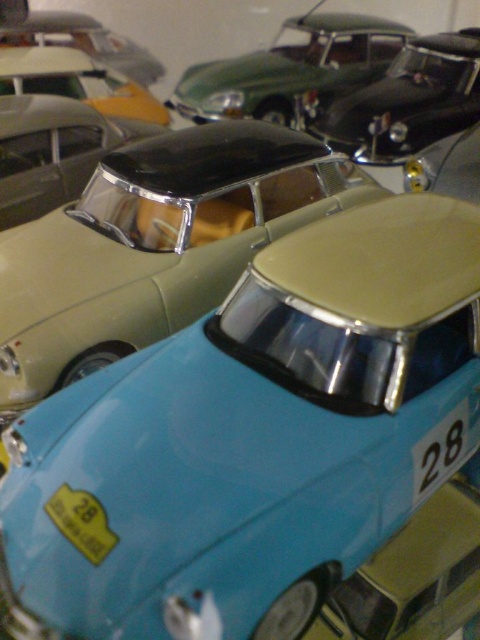
Based on the photo, who is lower down, light blue plastic car at center or metallic green car at upper center?

light blue plastic car at center

Which is behind, point (75, 221) or point (237, 90)?

Positioned behind is point (237, 90).

Who is more distant from viewer, (245, 250) or (295, 118)?

Positioned behind is point (295, 118).

Find the location of a particular element. The image size is (480, 640). light blue plastic car at center is located at coordinates (154, 244).

Which of these two, light blue glossy car at center or light blue plastic car at center, stands shorter?

Standing shorter between the two is light blue glossy car at center.

Image resolution: width=480 pixels, height=640 pixels. Describe the element at coordinates (253, 440) in the screenshot. I see `light blue glossy car at center` at that location.

This screenshot has width=480, height=640. What do you see at coordinates (253, 440) in the screenshot? I see `light blue glossy car at center` at bounding box center [253, 440].

Locate an element on the screen. This screenshot has width=480, height=640. light blue glossy car at center is located at coordinates (253, 440).

This screenshot has height=640, width=480. What do you see at coordinates (253, 440) in the screenshot?
I see `light blue glossy car at center` at bounding box center [253, 440].

Is light blue glossy car at center to the right of metallic green car at upper center from the viewer's perspective?

No, light blue glossy car at center is not to the right of metallic green car at upper center.

Does point (424, 376) come in front of point (287, 93)?

Yes, point (424, 376) is in front of point (287, 93).

At what (x,y) coordinates should I click in order to perform the action: click on light blue glossy car at center. Please return your answer as a coordinate pair (x, y). Looking at the image, I should click on (253, 440).